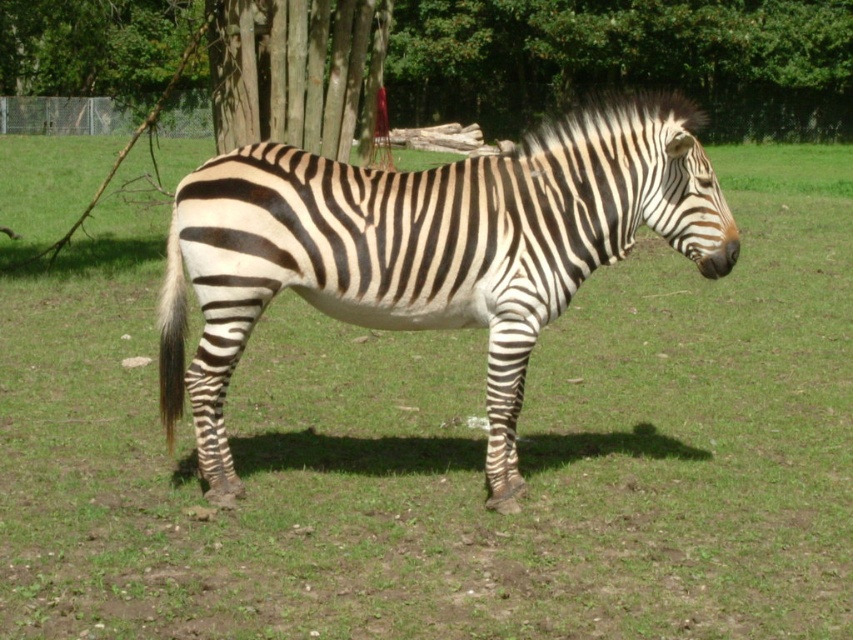
Question: Is black and white striped zebra at center positioned behind rough bark tree at upper center?

Choices:
 (A) yes
 (B) no

Answer: (B)

Question: Which object is positioned closest to the green leafy tree at upper center?

Choices:
 (A) black and white striped zebra at center
 (B) rough bark tree at upper center

Answer: (B)

Question: Does black and white striped zebra at center appear over green leafy tree at upper center?

Choices:
 (A) yes
 (B) no

Answer: (B)

Question: Estimate the real-world distances between objects in this image. Which object is farther from the green leafy tree at upper center?

Choices:
 (A) black and white striped zebra at center
 (B) rough bark tree at upper center

Answer: (A)

Question: Which point is farther to the camera?

Choices:
 (A) green leafy tree at upper center
 (B) black and white striped zebra at center

Answer: (A)

Question: Is black and white striped zebra at center below rough bark tree at upper center?

Choices:
 (A) yes
 (B) no

Answer: (A)